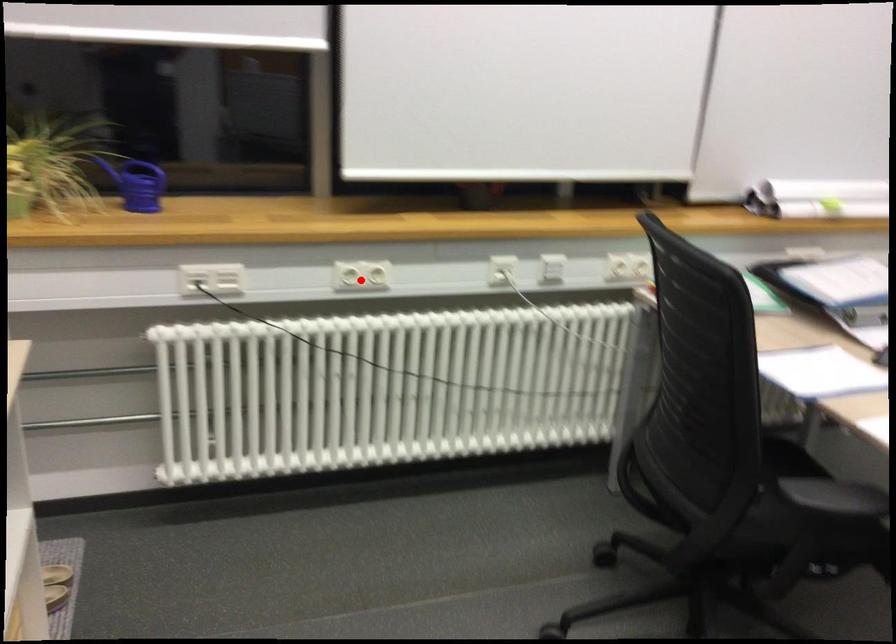
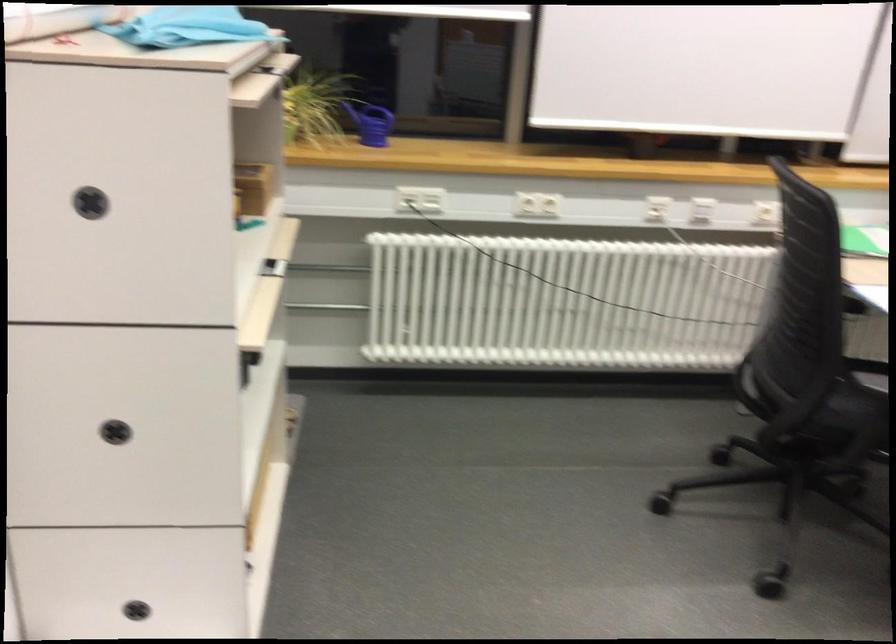
Locate, in the second image, the point that corresponds to the highlighted location in the first image.

(537, 205)